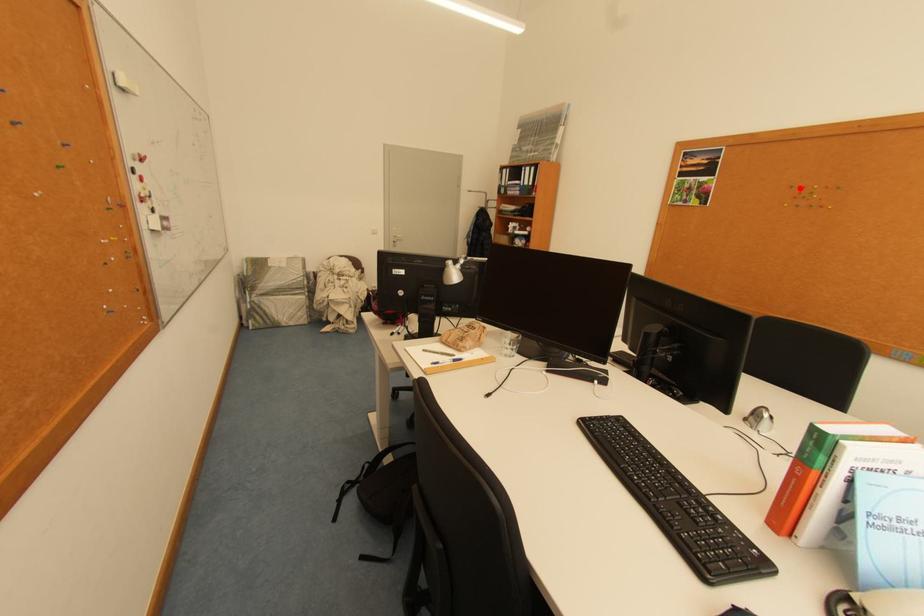
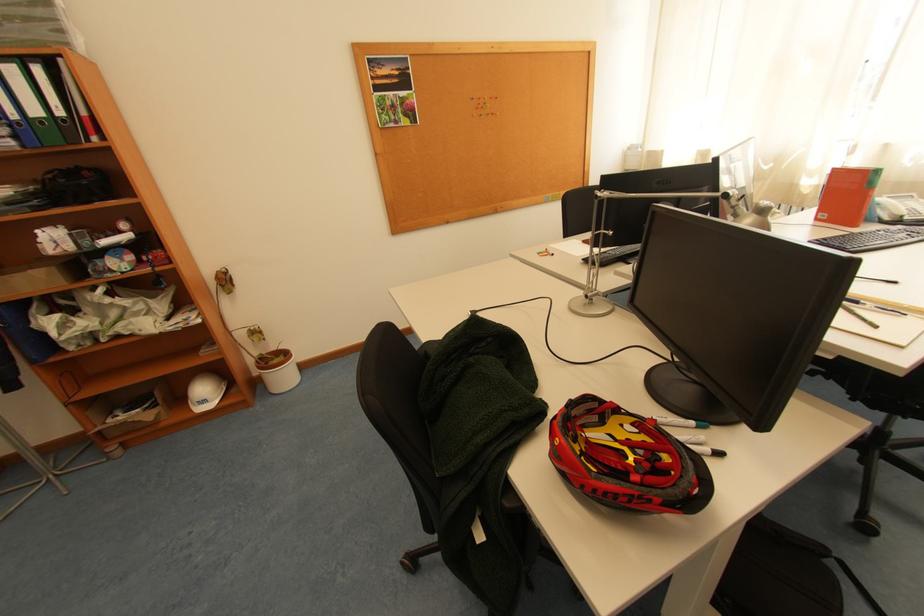
In the second image, find the point that corresponds to the highlighted location in the first image.

(480, 100)